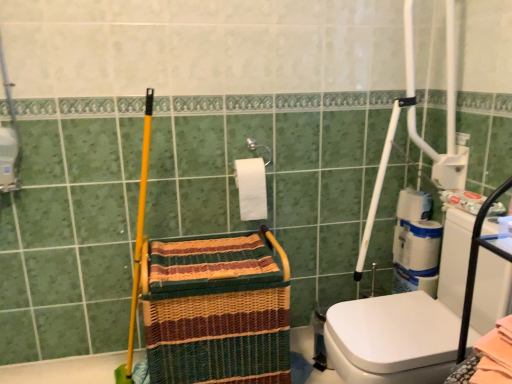
Question: Considering the relative sizes of white matte toilet paper at right, which appears as the 2th toilet paper when viewed from the front, and woven straw basket at center in the image provided, is white matte toilet paper at right, which appears as the 2th toilet paper when viewed from the front, shorter than woven straw basket at center?

Choices:
 (A) yes
 (B) no

Answer: (A)

Question: Does white matte toilet paper at right, which appears as the 2th toilet paper when viewed from the front, lie behind woven straw basket at center?

Choices:
 (A) no
 (B) yes

Answer: (B)

Question: Is white matte toilet paper at right, which appears as the 2th toilet paper when viewed from the front, oriented away from woven straw basket at center?

Choices:
 (A) yes
 (B) no

Answer: (B)

Question: From a real-world perspective, is white matte toilet paper at right, placed as the 2th toilet paper when sorted from left to right, located higher than woven straw basket at center?

Choices:
 (A) no
 (B) yes

Answer: (B)

Question: From a real-world perspective, is white matte toilet paper at right, which appears as the 2th toilet paper when viewed from the front, located beneath woven straw basket at center?

Choices:
 (A) no
 (B) yes

Answer: (A)

Question: In terms of height, does woven straw basket at center look taller or shorter compared to white matte toilet paper at right, which ranks as the 1th toilet paper in back-to-front order?

Choices:
 (A) short
 (B) tall

Answer: (B)

Question: Is woven straw basket at center to the left or to the right of white matte toilet paper at right, placed as the 2th toilet paper when sorted from left to right, in the image?

Choices:
 (A) left
 (B) right

Answer: (A)

Question: From the image's perspective, is woven straw basket at center located above or below white matte toilet paper at right, which appears as the 2th toilet paper when viewed from the front?

Choices:
 (A) above
 (B) below

Answer: (B)

Question: From a real-world perspective, relative to white matte toilet paper at right, the 1th toilet paper viewed from the right, is woven straw basket at center vertically above or below?

Choices:
 (A) above
 (B) below

Answer: (B)

Question: From the image's perspective, is white matte toilet paper at right, which appears as the 2th toilet paper when viewed from the front, above or below white glossy washer at right?

Choices:
 (A) below
 (B) above

Answer: (B)

Question: Is point (415, 210) positioned closer to the camera than point (431, 372)?

Choices:
 (A) farther
 (B) closer

Answer: (A)

Question: Is white matte toilet paper at right, placed as the 2th toilet paper when sorted from left to right, taller or shorter than white glossy washer at right?

Choices:
 (A) tall
 (B) short

Answer: (B)

Question: Is white matte toilet paper at right, the 1th toilet paper viewed from the right, wider or thinner than white glossy washer at right?

Choices:
 (A) wide
 (B) thin

Answer: (B)

Question: Is woven straw basket at center inside or outside of white glossy washer at right?

Choices:
 (A) inside
 (B) outside

Answer: (B)

Question: Considering their positions, is woven straw basket at center located in front of or behind white glossy washer at right?

Choices:
 (A) front
 (B) behind

Answer: (B)